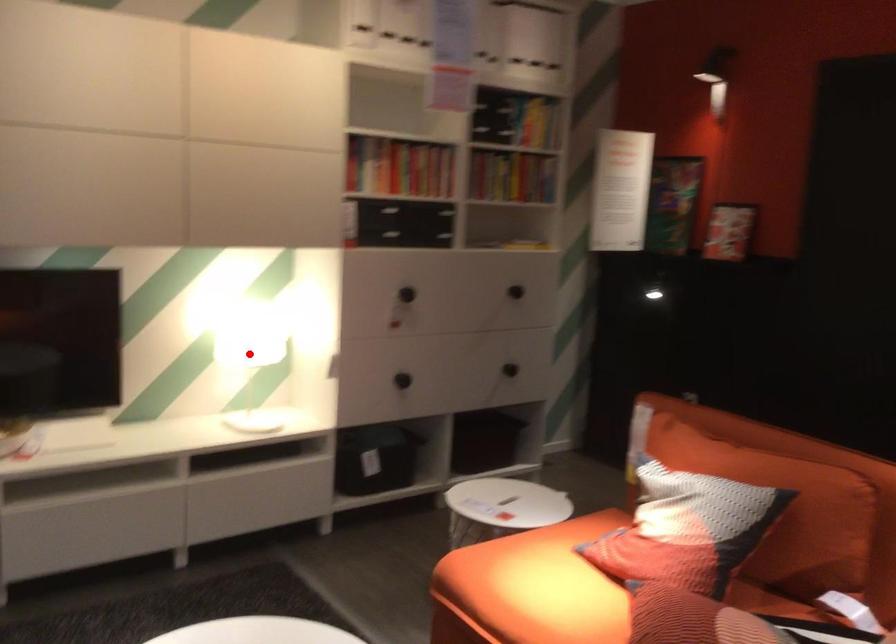
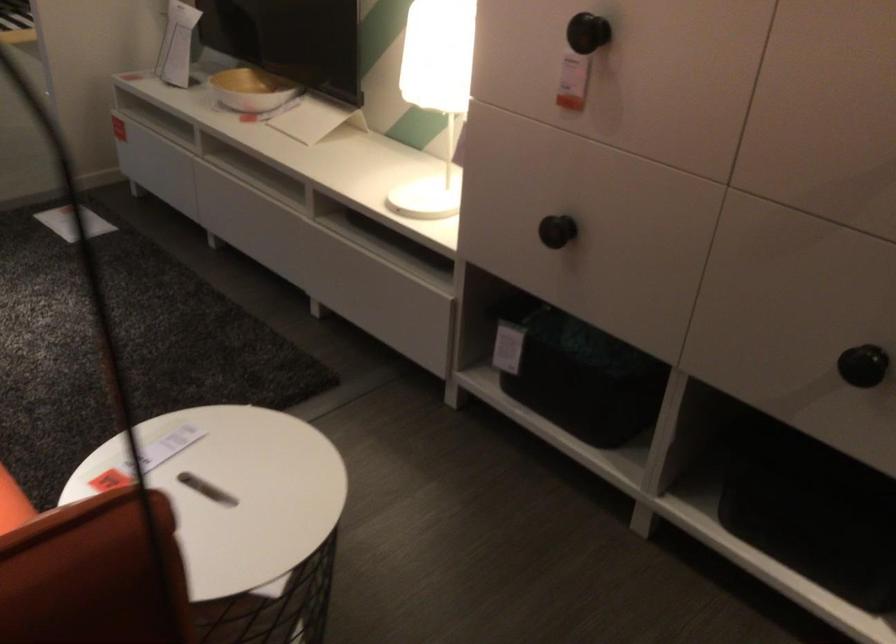
The point at the highlighted location is marked in the first image. Where is the corresponding point in the second image?

(392, 76)